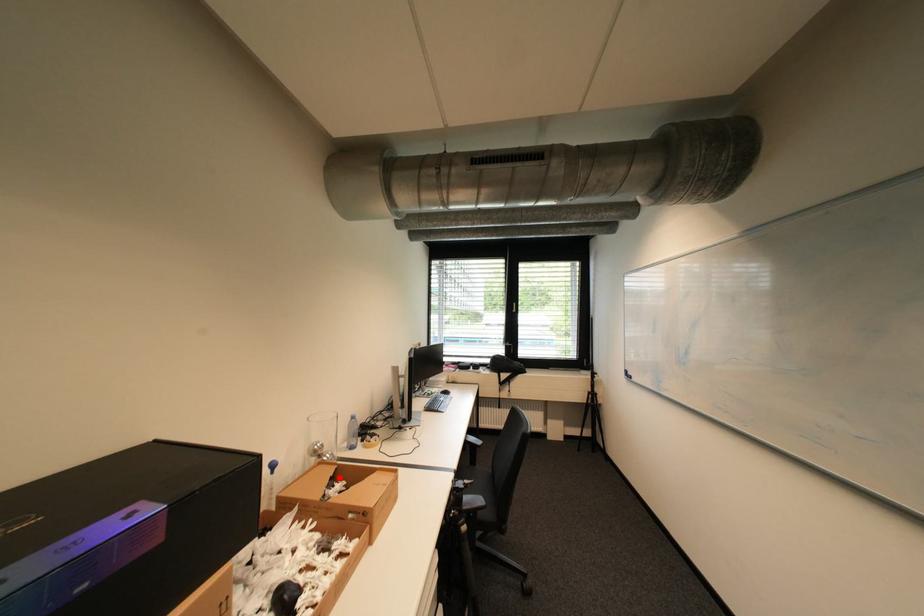
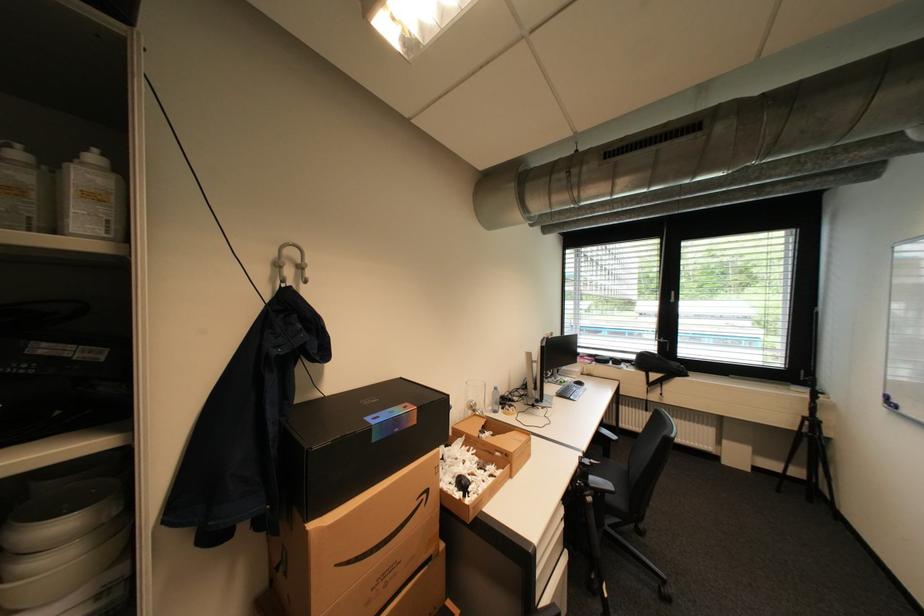
Question: I am providing you with two images of the same scene from different viewpoints. In image1, a red point is highlighted. Considering the same 3D point in image2, which of the following is correct?

Choices:
 (A) It is closer
 (B) It is farther

Answer: (B)